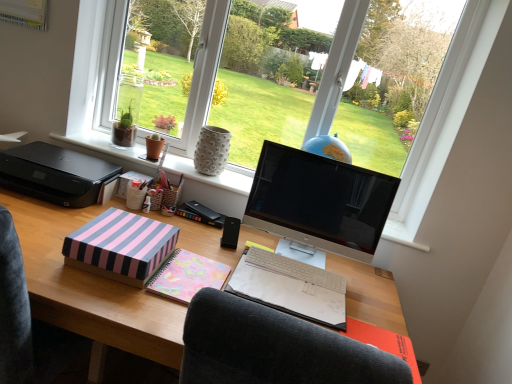
Identify the location of free space on the front side of pink striped cardboard box at center-left. (102, 294).